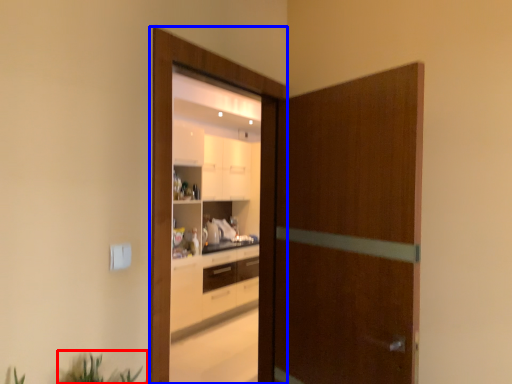
Question: Which of the following is the closest to the observer, plant (highlighted by a red box) or screen door (highlighted by a blue box)?

Choices:
 (A) plant
 (B) screen door

Answer: (A)